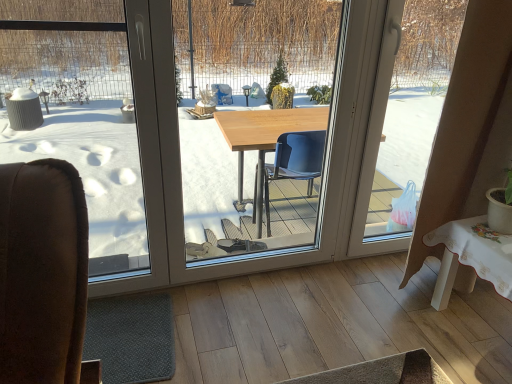
The image size is (512, 384). I want to click on vacant space to the right of gray rubber mat at lower left, so click(x=223, y=319).